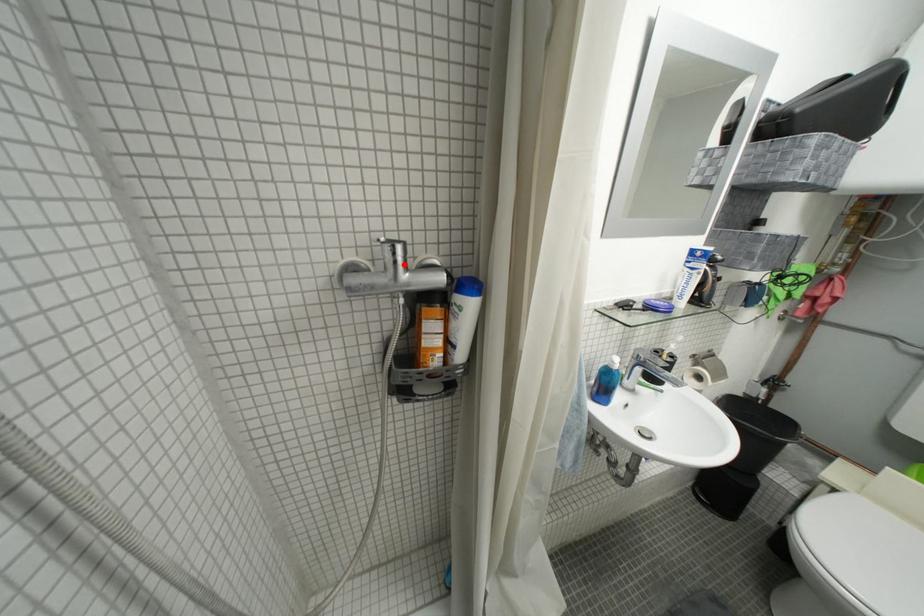
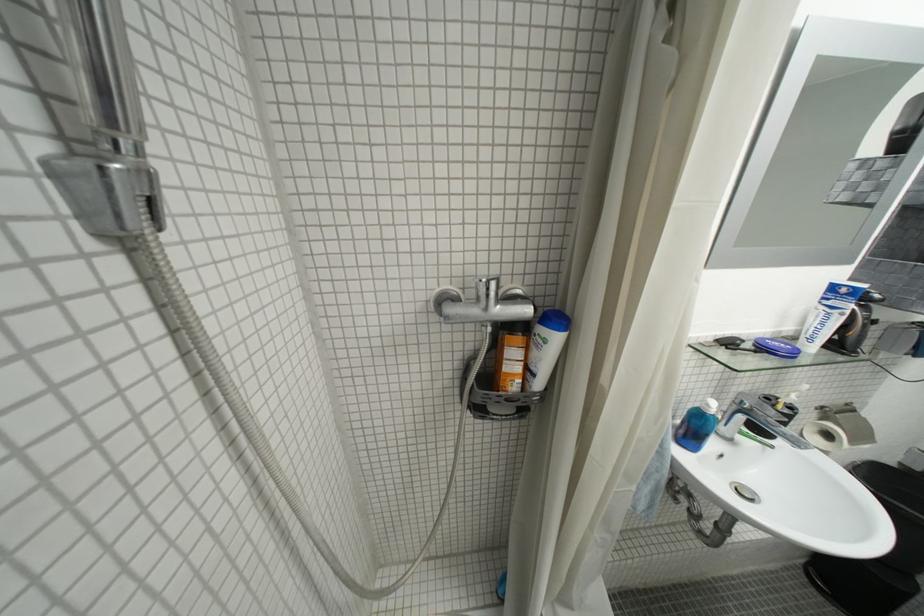
Find the pixel in the second image that matches the highlighted location in the first image.

(496, 298)